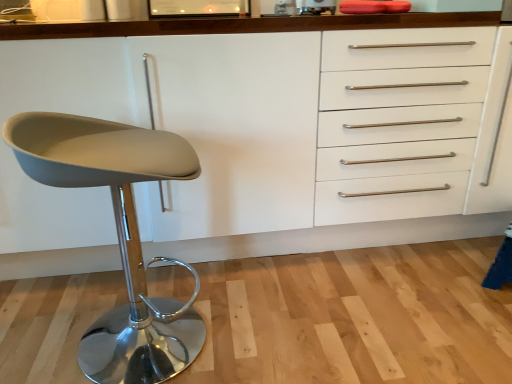
Find the location of a particular element. This screenshot has height=384, width=512. free space that is to the left of matte gray seat at left is located at coordinates (42, 328).